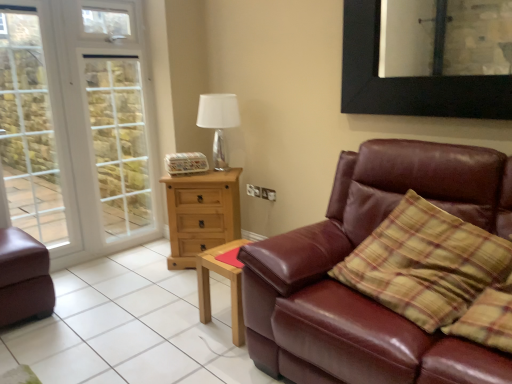
Question: Visually, is light wood rectangular table at center positioned to the left or to the right of light brown wooden chest of drawers at center?

Choices:
 (A) right
 (B) left

Answer: (A)

Question: From the image's perspective, relative to light brown wooden chest of drawers at center, is light wood rectangular table at center above or below?

Choices:
 (A) above
 (B) below

Answer: (B)

Question: Which is farther from the white glass screen door at left?

Choices:
 (A) shiny brown leather couch at right, which is counted as the 1th studio couch, starting from the right
 (B) matte brown leather couch at lower left, acting as the 1th studio couch starting from the left
 (C) brown leather couch at lower right
 (D) light brown wooden chest of drawers at center
 (E) white glossy table lamp at upper center

Answer: (A)

Question: Which of these objects is positioned farthest from the light wood rectangular table at center?

Choices:
 (A) brown leather couch at lower right
 (B) shiny brown leather couch at right, which is counted as the 1th studio couch, starting from the right
 (C) matte brown leather couch at lower left, the second studio couch from the right
 (D) white glass window at left
 (E) white glossy table lamp at upper center

Answer: (D)